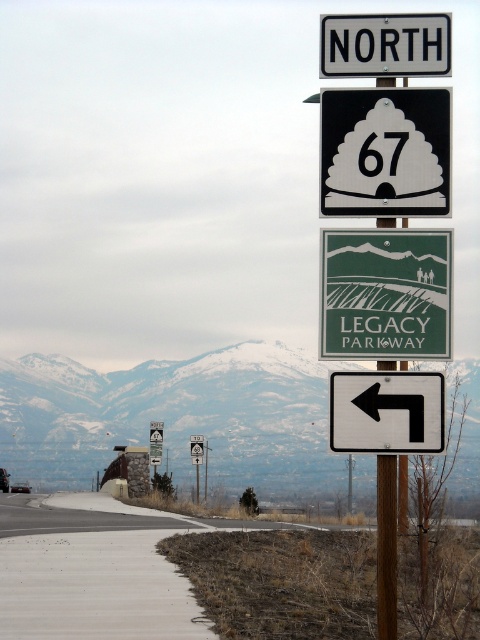
You are standing at the roadside and see the snowy mountain at upper center and the white plastic arrow at left. Which object appears closer to you?

The snowy mountain at upper center appears closer because it is in front of the white plastic arrow at left.

Based on the scene description, where is the white plastic arrow at left located in relation to the other road signs?

The white plastic arrow at left is located at point (386, 412).

You are a hiker planning to take a photo of the road signs. You want to ensure both the point at (84, 458) and the point at (421, 404) are visible in the frame. Based on their positions, which point should be closer to the camera?

Point (421, 404) is closer to the camera because it is in front of point (84, 458).